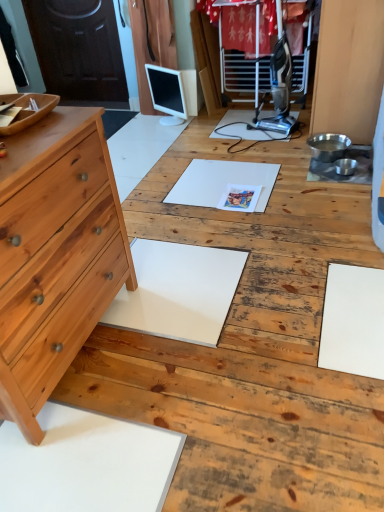
Question: Does white glossy computer monitor at center appear on the left side of natural wood chest of drawers at left?

Choices:
 (A) no
 (B) yes

Answer: (A)

Question: Considering the relative sizes of white glossy computer monitor at center and natural wood chest of drawers at left in the image provided, is white glossy computer monitor at center shorter than natural wood chest of drawers at left?

Choices:
 (A) no
 (B) yes

Answer: (B)

Question: Is white glossy computer monitor at center outside natural wood chest of drawers at left?

Choices:
 (A) yes
 (B) no

Answer: (A)

Question: Is white glossy computer monitor at center oriented towards natural wood chest of drawers at left?

Choices:
 (A) yes
 (B) no

Answer: (B)

Question: Can you confirm if white glossy computer monitor at center is smaller than natural wood chest of drawers at left?

Choices:
 (A) no
 (B) yes

Answer: (B)

Question: From the image's perspective, is white glossy computer monitor at center on top of natural wood chest of drawers at left?

Choices:
 (A) no
 (B) yes

Answer: (B)

Question: Does natural wood chest of drawers at left have a greater width compared to white glossy computer monitor at center?

Choices:
 (A) no
 (B) yes

Answer: (B)

Question: Is natural wood chest of drawers at left not close to white glossy computer monitor at center?

Choices:
 (A) no
 (B) yes

Answer: (B)

Question: From the image's perspective, does natural wood chest of drawers at left appear higher than white glossy computer monitor at center?

Choices:
 (A) no
 (B) yes

Answer: (A)

Question: Considering the relative positions of natural wood chest of drawers at left and white glossy computer monitor at center in the image provided, is natural wood chest of drawers at left in front of white glossy computer monitor at center?

Choices:
 (A) no
 (B) yes

Answer: (B)

Question: From the image's perspective, is natural wood chest of drawers at left below white glossy computer monitor at center?

Choices:
 (A) yes
 (B) no

Answer: (A)

Question: Is natural wood chest of drawers at left further to the viewer compared to white glossy computer monitor at center?

Choices:
 (A) yes
 (B) no

Answer: (B)

Question: In the image, is white glossy computer monitor at center positioned in front of or behind natural wood chest of drawers at left?

Choices:
 (A) behind
 (B) front

Answer: (A)